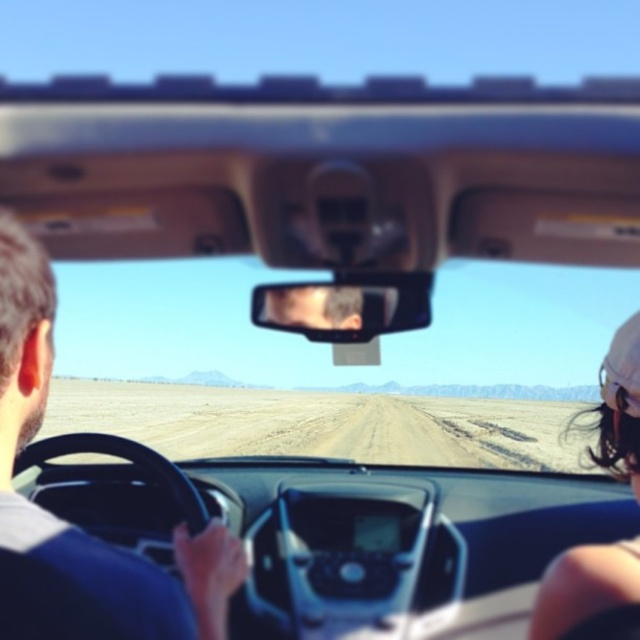
Question: Which is nearer to the white fabric cap at right?

Choices:
 (A) brown leather steering wheel at left
 (B) clear plastic view mirror at center

Answer: (A)

Question: Is white fabric cap at right positioned before clear plastic view mirror at center?

Choices:
 (A) yes
 (B) no

Answer: (A)

Question: Which object is the farthest from the brown leather steering wheel at left?

Choices:
 (A) white fabric cap at right
 (B) clear plastic view mirror at center

Answer: (B)

Question: Which point is farther from the camera taking this photo?

Choices:
 (A) click(608, 465)
 (B) click(154, 602)

Answer: (A)

Question: Where is brown leather steering wheel at left located in relation to white fabric cap at right in the image?

Choices:
 (A) above
 (B) below

Answer: (A)

Question: Can you confirm if brown leather steering wheel at left is bigger than clear plastic view mirror at center?

Choices:
 (A) no
 (B) yes

Answer: (B)